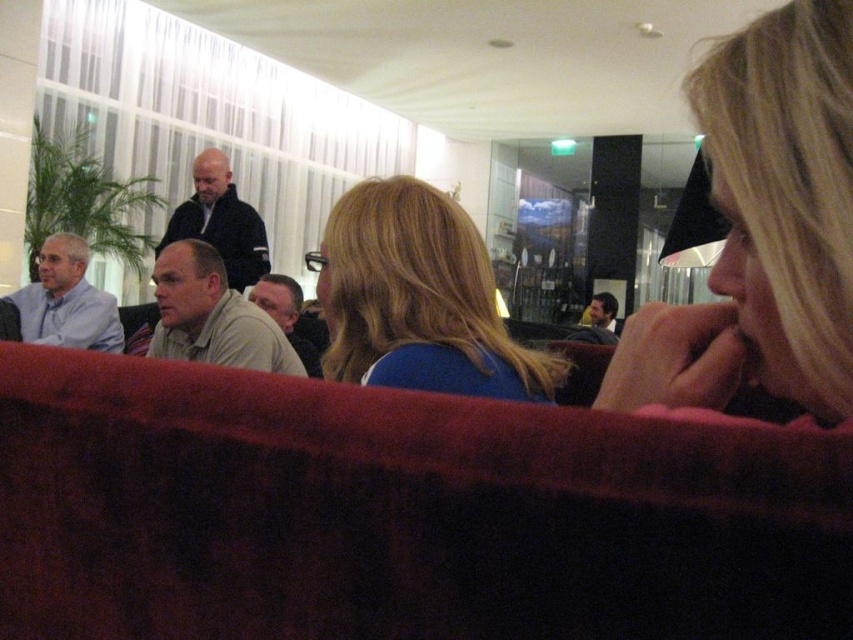
Does dark blue jacket at upper center have a lesser height compared to smooth brown leather jacket at center?

In fact, dark blue jacket at upper center may be taller than smooth brown leather jacket at center.

Where is `dark blue jacket at upper center`? Image resolution: width=853 pixels, height=640 pixels. dark blue jacket at upper center is located at coordinates (219, 221).

Is blonde hair at center positioned in front of light beige shirt at center?

Yes, blonde hair at center is closer to the viewer.

Does blonde hair at center have a lesser width compared to light beige shirt at center?

Correct, blonde hair at center's width is less than light beige shirt at center's.

This screenshot has height=640, width=853. I want to click on blonde hair at center, so click(x=419, y=300).

Locate an element on the screen. Image resolution: width=853 pixels, height=640 pixels. blonde hair at center is located at coordinates (419, 300).

Is point (192, 262) less distant than point (267, 280)?

Yes, it is.

Does light beige shirt at center come behind light beige sweater at center?

No.

Who is more forward, [233,324] or [270,301]?

Point [233,324]

Where is `light beige shirt at center`? The image size is (853, 640). light beige shirt at center is located at coordinates [212, 316].